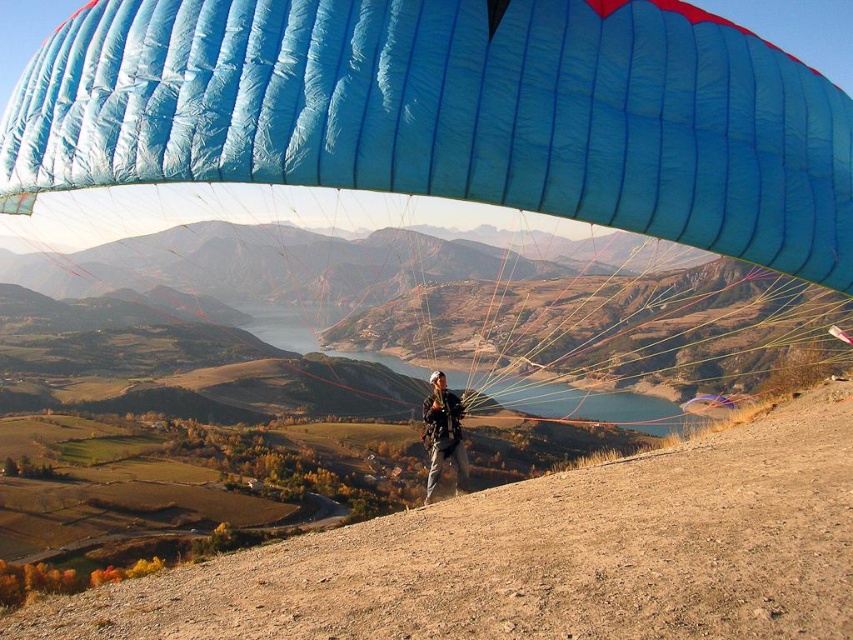
You are a drone operator trying to capture the blue fabric parachute at center in your camera frame. Your camera has a 100mm lens with a field of view that can only capture objects within a 10x10 pixel area centered at coordinates point 0.178, 0.532. If the parachute is exactly at that point, will it fit entirely within your camera frame?

The blue fabric parachute at center is located exactly at the coordinates point (x=453, y=113), so it will fit entirely within the camera frame since the frame is centered at those coordinates and the parachute is precisely at that point.

You are a photographer trying to capture the paraglider setup. You need to ensure that both the blue fabric parachute at center and the matte black helmet at center are fully visible in your shot. Based on their sizes, which object should you focus on to frame the shot appropriately?

The blue fabric parachute at center is wider than the matte black helmet at center, so you should focus on framing the blue fabric parachute at center to ensure both objects are fully visible.

Looking at this image, you are the pilot standing on the hilltop preparing to launch your paraglider. You notice the blue fabric parachute at center and the matte black helmet at center. Which object is positioned higher from the ground?

The matte black helmet at center is positioned higher from the ground than the blue fabric parachute at center because the blue fabric parachute at center is located below the matte black helmet at center.